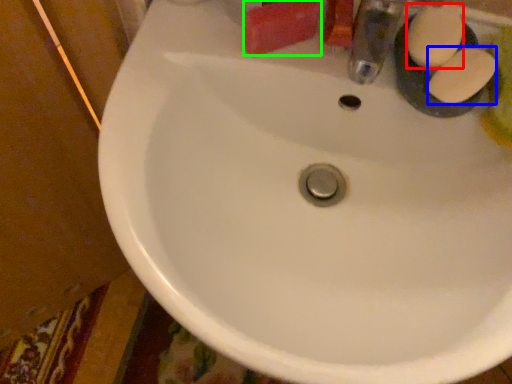
Question: Which object is positioned closest to soap (highlighted by a red box)? Select from soap (highlighted by a blue box) and soap (highlighted by a green box).

Choices:
 (A) soap
 (B) soap

Answer: (A)